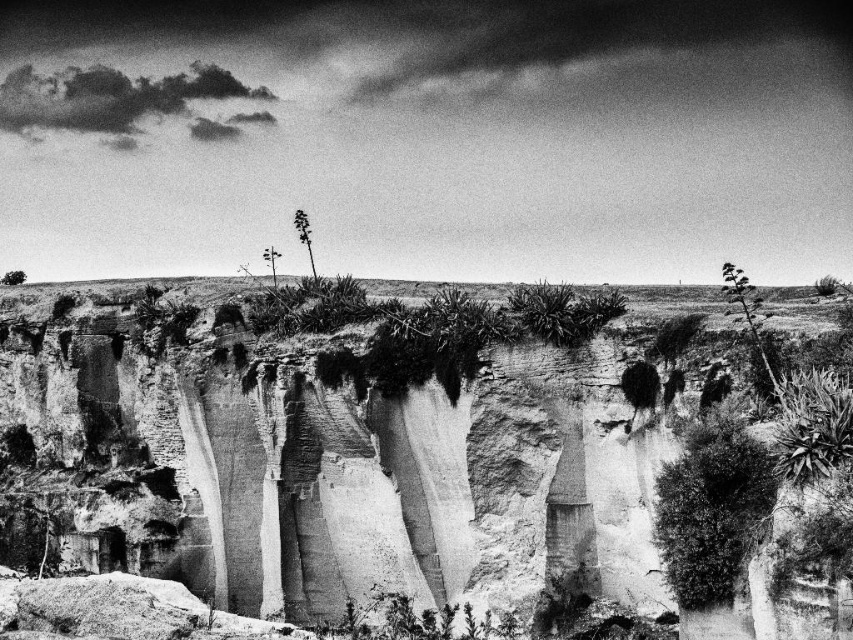
Does green leafy plant at upper center have a greater width compared to green leafy tree at upper left?

No.

Is point (277, 259) positioned behind point (7, 273)?

That is False.

Is point (273, 250) positioned before point (15, 276)?

No, (273, 250) is further to viewer.

Where is `green leafy plant at upper center`? green leafy plant at upper center is located at coordinates (271, 262).

Can you confirm if rough textured cliff face at center is wider than green leafy tree at upper left?

Yes.

Is rough textured cliff face at center thinner than green leafy tree at upper left?

No.

Identify the location of rough textured cliff face at center. (415, 470).

Who is positioned more to the left, thick green foliage at upper right or green leafy plant at upper center?

From the viewer's perspective, green leafy plant at upper center appears more on the left side.

Which is above, thick green foliage at upper right or green leafy plant at upper center?

green leafy plant at upper center is above.

What are the coordinates of `thick green foliage at upper right` in the screenshot? It's located at (746, 310).